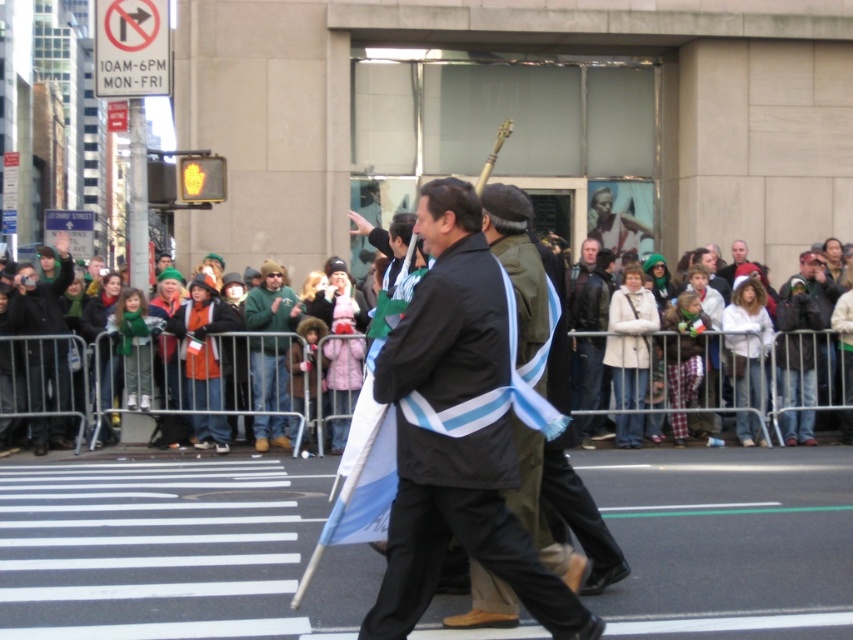
Does black fabric jacket at center have a larger size compared to multicolored fabric at center?

Indeed, black fabric jacket at center has a larger size compared to multicolored fabric at center.

Is point (409, 314) more distant than point (717, 333)?

No.

The image size is (853, 640). In order to click on black fabric jacket at center in this screenshot , I will do `click(465, 419)`.

Does multicolored fabric at center have a greater width compared to green fleece jacket at center?

In fact, multicolored fabric at center might be narrower than green fleece jacket at center.

Does multicolored fabric at center appear on the right side of green fleece jacket at center?

In fact, multicolored fabric at center is to the left of green fleece jacket at center.

The width and height of the screenshot is (853, 640). In order to click on multicolored fabric at center in this screenshot , I will do pos(57,381).

Consider the image. Can you confirm if green fleece jacket at center is positioned below light brown leather jacket at center?

Correct, green fleece jacket at center is located below light brown leather jacket at center.

Between point (267, 371) and point (727, 266), which one is positioned in front?

Point (267, 371) is more forward.

Where is `green fleece jacket at center`? The width and height of the screenshot is (853, 640). green fleece jacket at center is located at coordinates (271, 301).